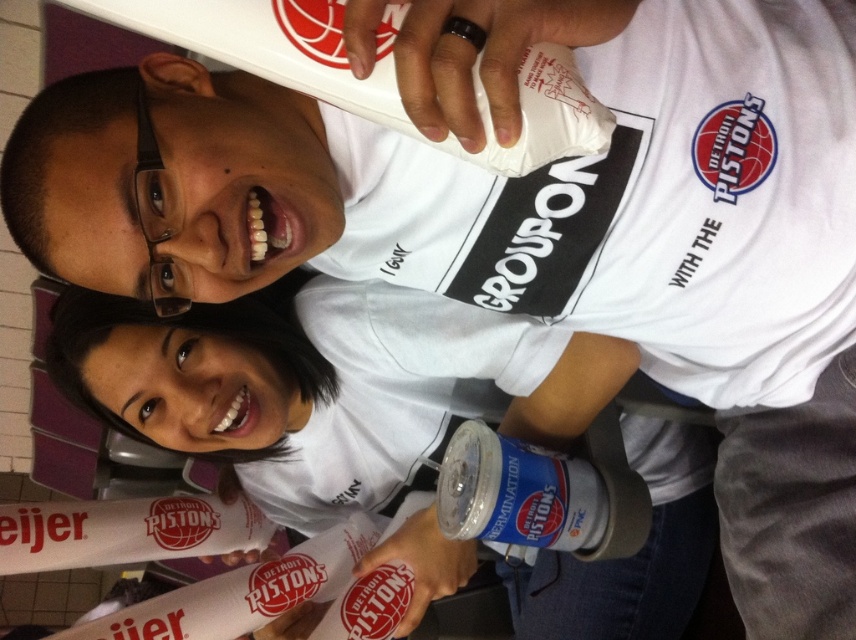
Is point (667, 536) closer to camera compared to point (604, 518)?

No, (667, 536) is further to viewer.

Is white matte t-shirt at center to the left of blue metallic can at center from the viewer's perspective?

Yes, white matte t-shirt at center is to the left of blue metallic can at center.

Is point (635, 451) positioned behind point (514, 540)?

Yes, it is behind point (514, 540).

Locate an element on the screen. Image resolution: width=856 pixels, height=640 pixels. white matte t-shirt at center is located at coordinates (325, 385).